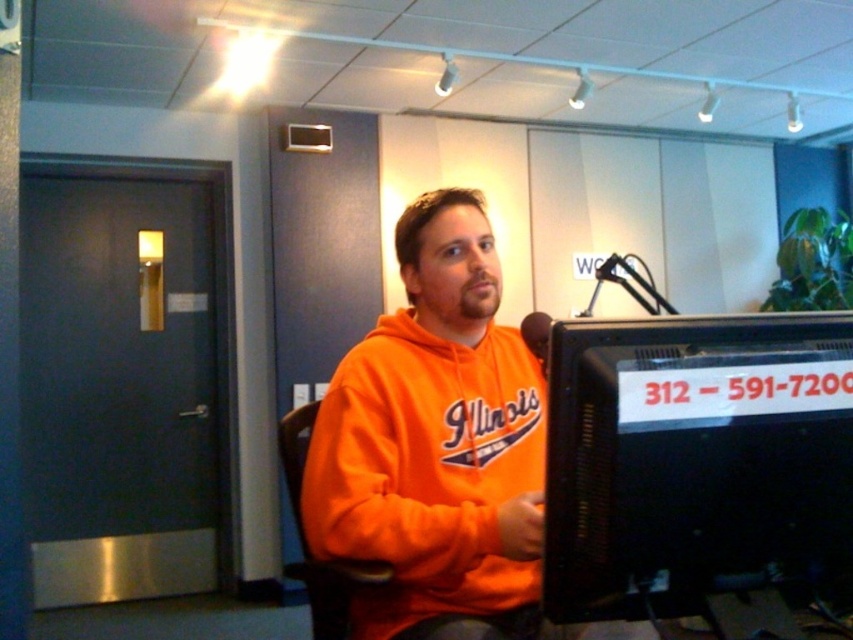
Question: Which point is closer to the camera?

Choices:
 (A) (375, 442)
 (B) (323, 600)
 (C) (604, 586)

Answer: (C)

Question: Which point appears closest to the camera in this image?

Choices:
 (A) (299, 506)
 (B) (686, 492)

Answer: (B)

Question: Is black plastic monitor at right smaller than orange fabric swivel chair at center?

Choices:
 (A) no
 (B) yes

Answer: (B)

Question: Can you confirm if orange fleece sweatshirt at center is positioned below orange fabric swivel chair at center?

Choices:
 (A) no
 (B) yes

Answer: (A)

Question: Can you confirm if black plastic monitor at right is smaller than orange fleece sweatshirt at center?

Choices:
 (A) no
 (B) yes

Answer: (B)

Question: Estimate the real-world distances between objects in this image. Which object is closer to the orange fleece sweatshirt at center?

Choices:
 (A) black plastic monitor at right
 (B) orange fabric swivel chair at center

Answer: (B)